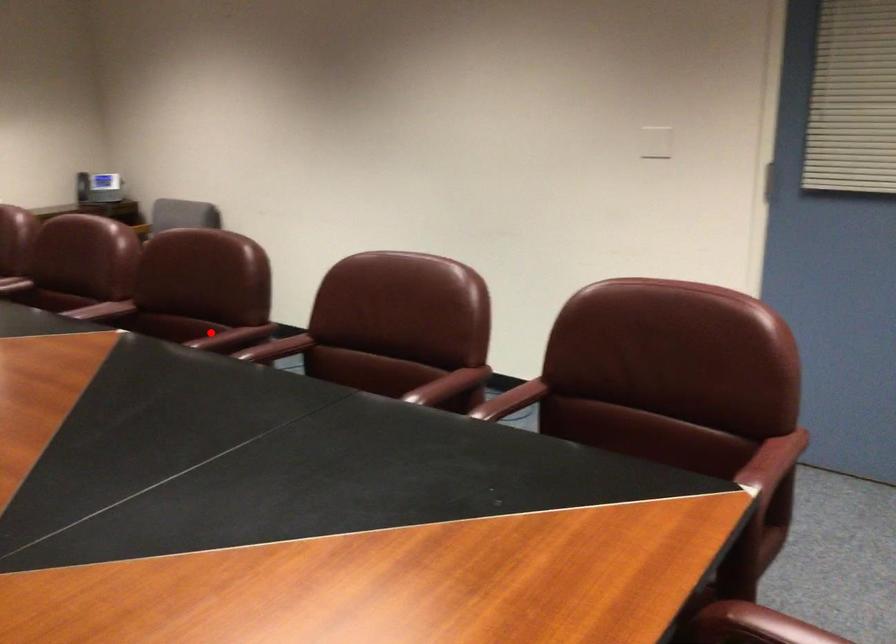
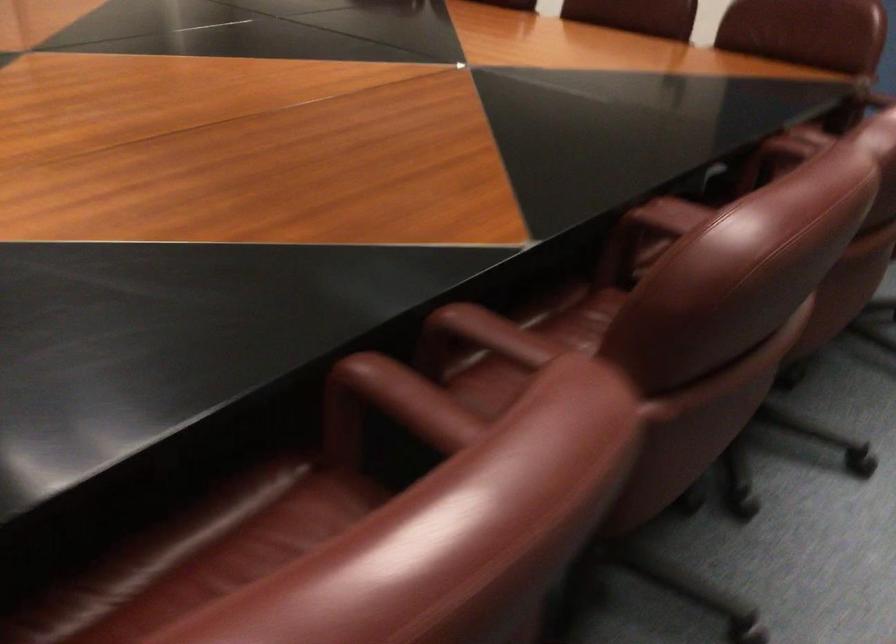
Locate, in the second image, the point that corresponds to the highlighted location in the first image.

(493, 334)